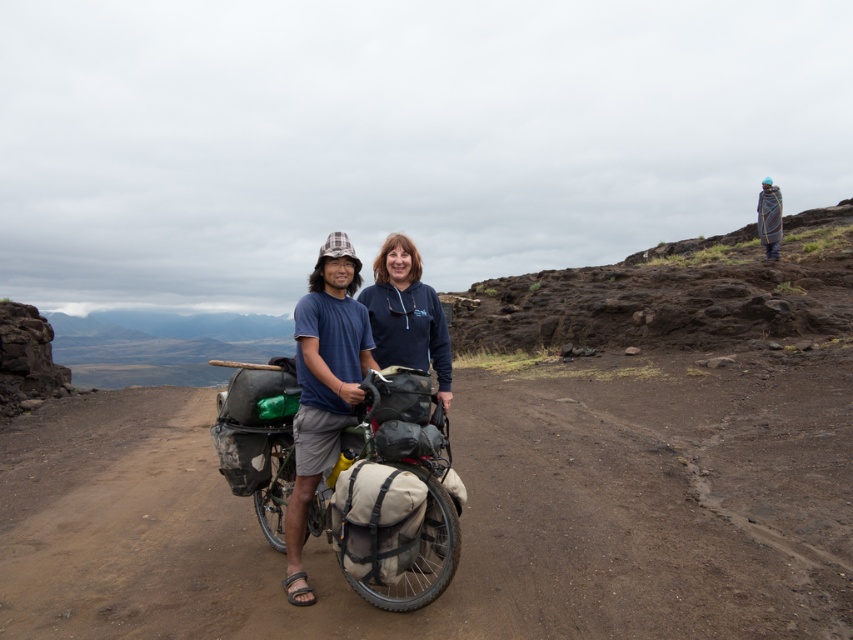
Question: Considering the relative positions of brown dirt track at center and beige canvas bicycle at center in the image provided, where is brown dirt track at center located with respect to beige canvas bicycle at center?

Choices:
 (A) left
 (B) right

Answer: (A)

Question: Can you confirm if beige canvas bicycle at center is thinner than matte blue shirt at center?

Choices:
 (A) yes
 (B) no

Answer: (B)

Question: Which of the following is the farthest from the observer?

Choices:
 (A) (386, 529)
 (B) (10, 573)
 (C) (393, 257)
 (D) (339, 308)

Answer: (B)

Question: Which of the following is the farthest from the observer?

Choices:
 (A) dark blue hoodie at center
 (B) matte blue shirt at center
 (C) beige canvas bicycle at center

Answer: (A)

Question: Which point is farther from the camera taking this photo?

Choices:
 (A) (279, 502)
 (B) (606, 586)
 (C) (442, 353)

Answer: (A)

Question: In this image, where is brown dirt track at center located relative to beige canvas bicycle at center?

Choices:
 (A) right
 (B) left

Answer: (B)